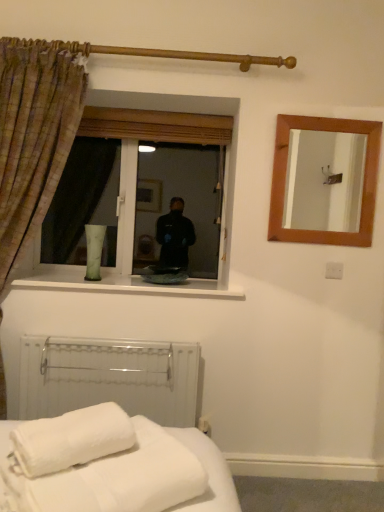
Question: Is wooden mirror at upper right inside or outside of white soft towel at lower left?

Choices:
 (A) inside
 (B) outside

Answer: (B)

Question: From the image's perspective, is wooden mirror at upper right located above or below white soft towel at lower left?

Choices:
 (A) above
 (B) below

Answer: (A)

Question: Considering the real-world distances, which object is closest to the white plastic radiator at lower left?

Choices:
 (A) plaid fabric curtain at left
 (B) white soft towel at lower left
 (C) wooden mirror at upper right
 (D) transparent glass window at center

Answer: (D)

Question: Which of these objects is positioned closest to the transparent glass window at center?

Choices:
 (A) wooden mirror at upper right
 (B) white soft towel at lower left
 (C) white plastic radiator at lower left
 (D) plaid fabric curtain at left

Answer: (D)